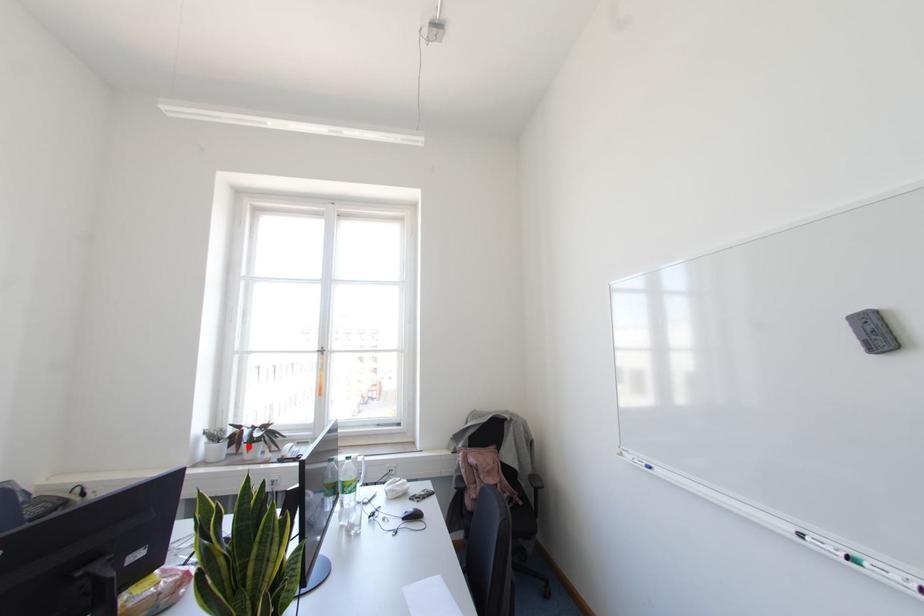
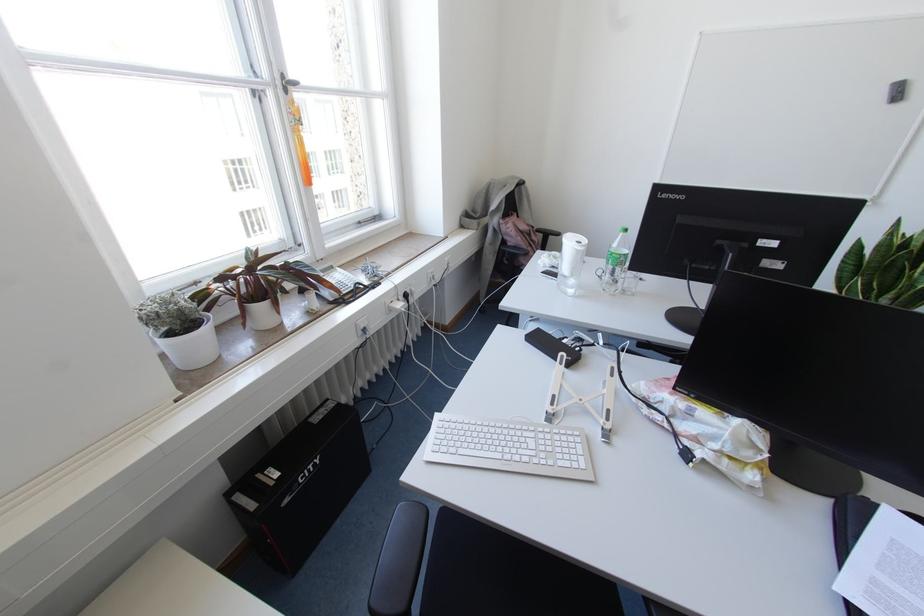
Question: I am providing you with two images of the same scene from different viewpoints. In image1, a red point is highlighted. Considering the same 3D point in image2, which of the following is correct?

Choices:
 (A) It is closer
 (B) It is farther

Answer: (A)